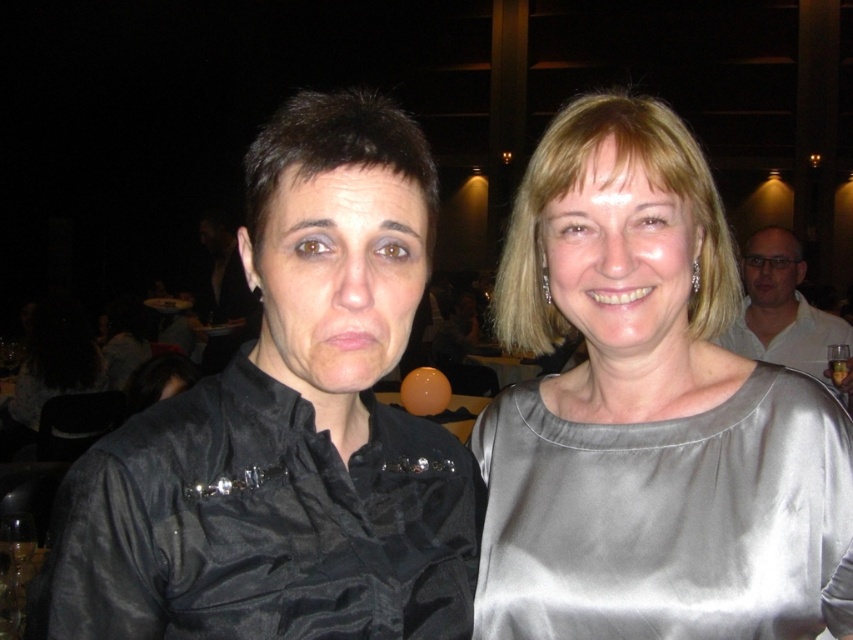
You are a photographer trying to capture a group photo of the matte black face at center and the satin gray face at center. The camera you are using has a minimum focusing distance of 10 inches. Will you be able to take a clear photo of both faces without moving either of them?

The distance between the matte black face at center and the satin gray face at center is 9.69 inches, which is less than the camera minimum focusing distance of 10 inches. Therefore, you will not be able to take a clear photo of both faces without moving them closer together.

Looking at this image, you are at a formal event and see two people. The person on the left is wearing a black satin top with a decorative brooch near the collar, and the person on the right is wearing a shiny silver or gray satin top. There is a point marked at coordinates [337,276]. Based on the scene description, which person is closest to this point?

The point at [337,276] marks the matte black face at center, so the person closest to this point is the one wearing the black satin top with a decorative brooch near the collar.